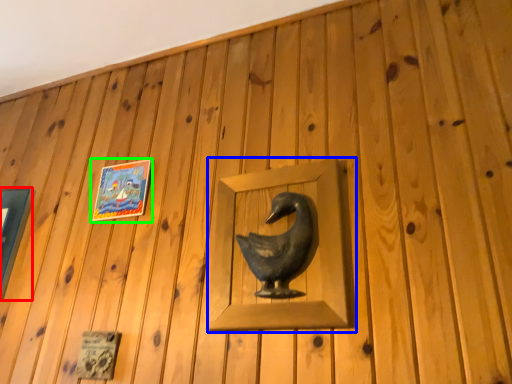
Question: Estimate the real-world distances between objects in this image. Which object is farther from picture frame (highlighted by a red box), sculpture (highlighted by a blue box) or picture frame (highlighted by a green box)?

Choices:
 (A) sculpture
 (B) picture frame

Answer: (A)